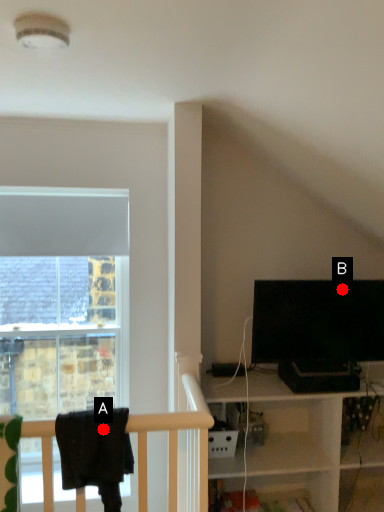
Question: Two points are circled on the image, labeled by A and B beside each circle. Among these points, which one is nearest to the camera?

Choices:
 (A) A is closer
 (B) B is closer

Answer: (A)